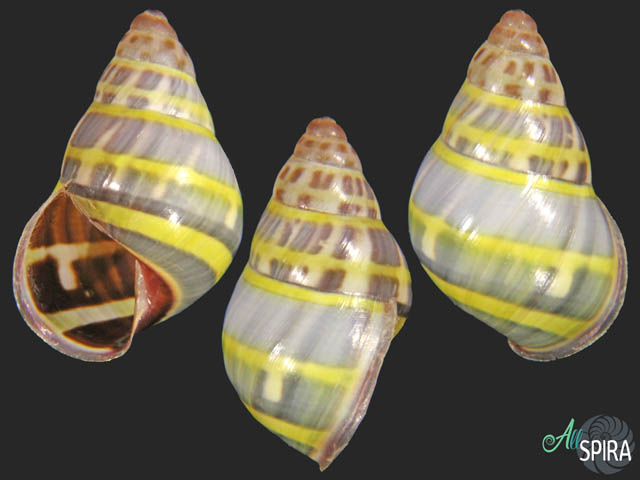
You are a GUI agent. You are given a task and a screenshot of the screen. Output one action in this format:
    pyautogui.click(x=<x>, y=<y>)
    Task: Click on the middle shell
    The width and height of the screenshot is (640, 480).
    Given the screenshot: What is the action you would take?
    291,275